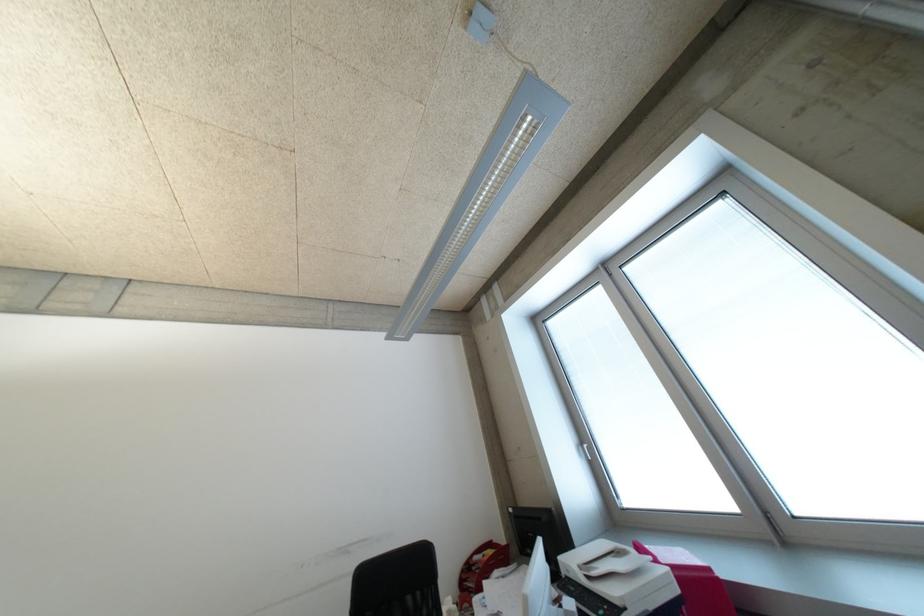
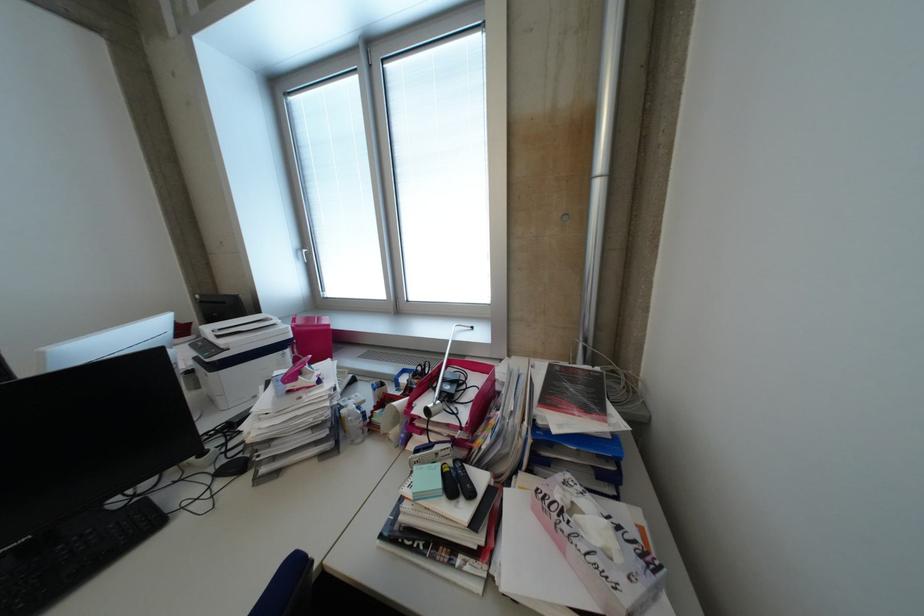
In the second image, find the point that corresponds to [589,450] in the first image.

(309, 254)